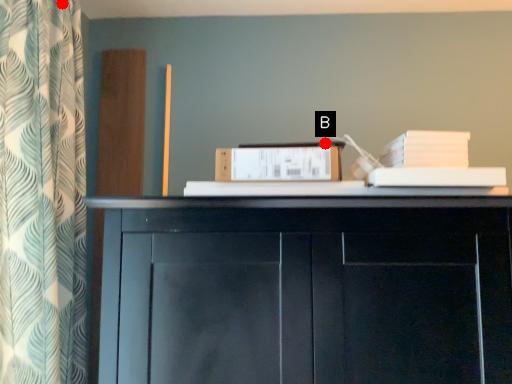
Question: Two points are circled on the image, labeled by A and B beside each circle. Which point is further to the camera?

Choices:
 (A) A is further
 (B) B is further

Answer: (A)